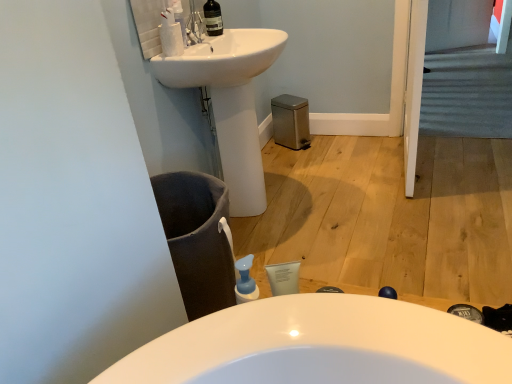
Question: From the image's perspective, relative to white glossy soap dispenser at upper center, is transparent glass bottle at upper center above or below?

Choices:
 (A) above
 (B) below

Answer: (A)

Question: From a real-world perspective, is transparent glass bottle at upper center above or below white glossy soap dispenser at upper center?

Choices:
 (A) above
 (B) below

Answer: (A)

Question: Which of these objects is positioned closest to the white glossy soap dispenser at upper center?

Choices:
 (A) white matte cleaning product at upper left
 (B) white glossy sink at upper center
 (C) transparent glass bottle at upper center
 (D) carpeted stairs at upper right

Answer: (A)

Question: Estimate the real-world distances between objects in this image. Which object is farther from the white glossy sink at upper center?

Choices:
 (A) white glossy soap dispenser at upper center
 (B) transparent glass bottle at upper center
 (C) carpeted stairs at upper right
 (D) white matte cleaning product at upper left

Answer: (C)